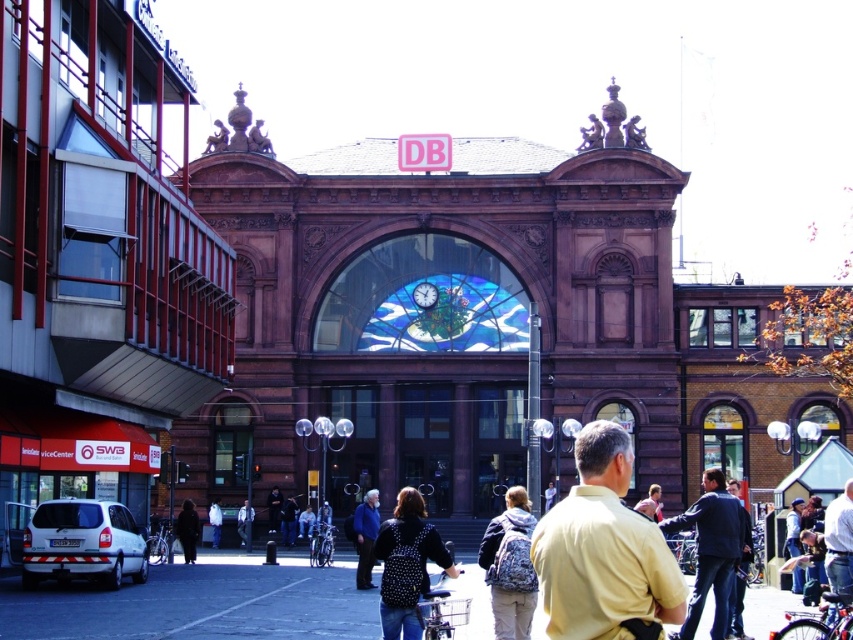
Question: Which point is farther from the camera taking this photo?

Choices:
 (A) (616, 474)
 (B) (364, 531)

Answer: (B)

Question: Which object appears farthest from the camera in this image?

Choices:
 (A) white fluffy cat at center
 (B) light blue shirt at center
 (C) polka dot backpack at center

Answer: (B)

Question: Can you confirm if dark blue jacket at center is positioned below white fluffy cat at center?

Choices:
 (A) yes
 (B) no

Answer: (B)

Question: Which object is farther from the camera taking this photo?

Choices:
 (A) light blue shirt at center
 (B) polka dot backpack at center

Answer: (A)

Question: Does light blue shirt at center appear over white fluffy cat at center?

Choices:
 (A) yes
 (B) no

Answer: (B)

Question: From the image, what is the correct spatial relationship of fluffy fabric backpack at center in relation to black wool coat at lower left?

Choices:
 (A) left
 (B) right

Answer: (B)